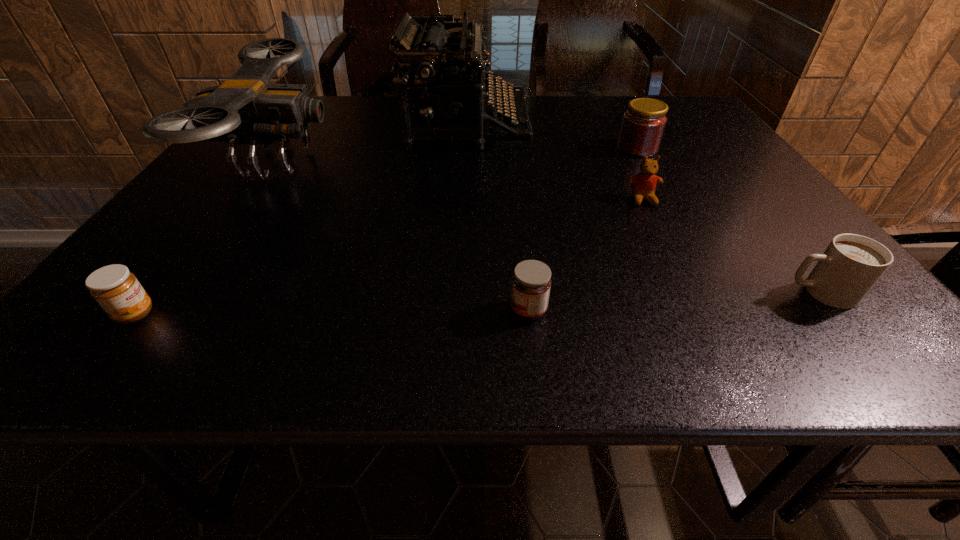
You are a GUI agent. You are given a task and a screenshot of the screen. Output one action in this format:
    pyautogui.click(x=<x>, y=<y>)
    Task: Click on the jam that is the second nearest to the leftmost jam
    The width and height of the screenshot is (960, 540).
    Given the screenshot: What is the action you would take?
    pyautogui.click(x=643, y=124)

In order to click on vacant space that satisfies the following two spatial constraints: 1. on the back side of the second jam from right to left; 2. on the front-facing side of the drone in this screenshot , I will do `click(513, 164)`.